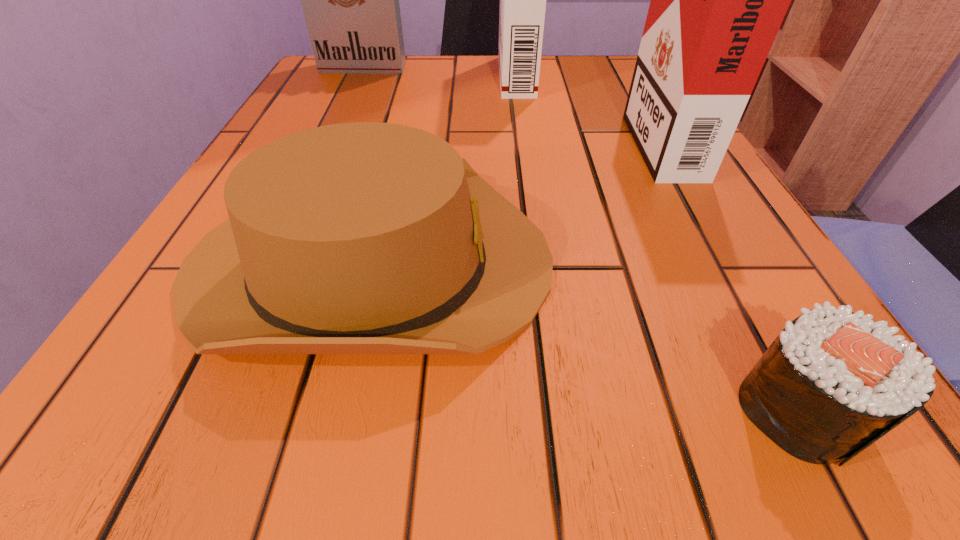
Find the location of `the third closest cigarette case to the sushi`. the third closest cigarette case to the sushi is located at coordinates (350, 0).

The height and width of the screenshot is (540, 960). Find the location of `vacant region that satisfies the following two spatial constraints: 1. on the front-facing side of the nearest cigarette case; 2. on the front side of the sushi`. vacant region that satisfies the following two spatial constraints: 1. on the front-facing side of the nearest cigarette case; 2. on the front side of the sushi is located at coordinates (810, 409).

This screenshot has height=540, width=960. I want to click on free space in the image that satisfies the following two spatial constraints: 1. on the front-facing side of the second shortest object; 2. on the right side of the shortest object, so click(332, 409).

The width and height of the screenshot is (960, 540). What are the coordinates of `blank area in the image that satisfies the following two spatial constraints: 1. on the front-facing side of the fourth tallest object; 2. on the right side of the sushi` in the screenshot? It's located at (332, 409).

Image resolution: width=960 pixels, height=540 pixels. Find the location of `free spot that satisfies the following two spatial constraints: 1. with the lid open on the shortest object; 2. on the right side of the leftmost cigarette case`. free spot that satisfies the following two spatial constraints: 1. with the lid open on the shortest object; 2. on the right side of the leftmost cigarette case is located at coordinates (203, 409).

Identify the location of vacant area that satisfies the following two spatial constraints: 1. on the back side of the sushi; 2. on the front-facing side of the cowboy hat. This screenshot has height=540, width=960. (719, 262).

I want to click on vacant space that satisfies the following two spatial constraints: 1. with the lid open on the leftmost cigarette case; 2. on the left side of the sushi, so click(x=203, y=409).